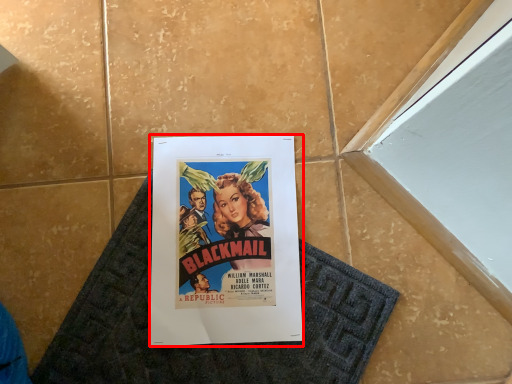
Question: Considering the relative positions of poster (annotated by the red box) and bath mat in the image provided, where is poster (annotated by the red box) located with respect to the staircase?

Choices:
 (A) left
 (B) right

Answer: (A)